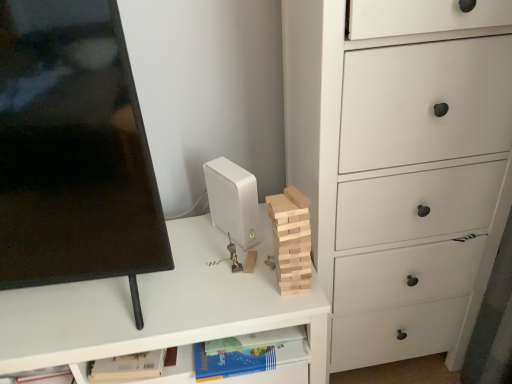
Locate an element on the screen. This screenshot has width=512, height=384. free spot to the left of white matte desktop computer at center is located at coordinates (190, 244).